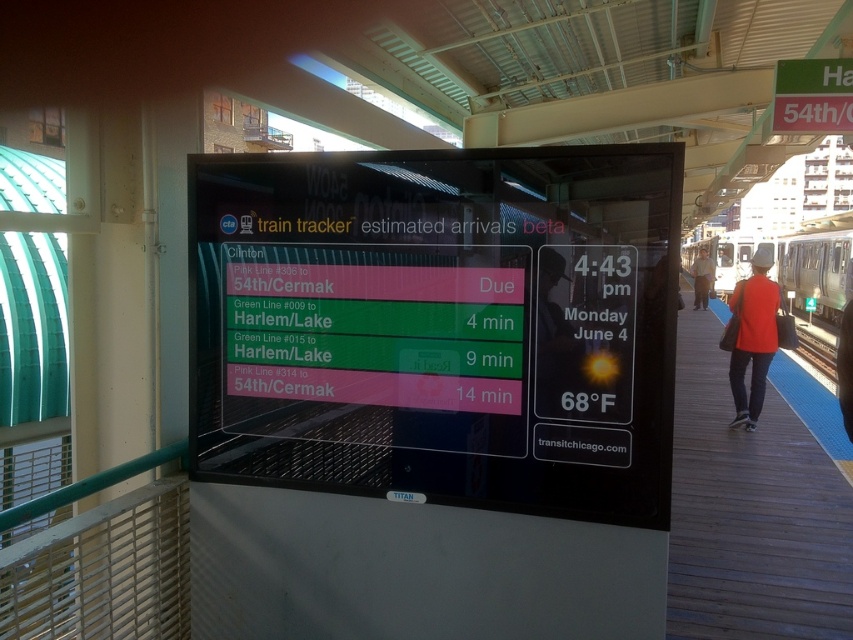
Question: Which is farther from the wooden platform at right?

Choices:
 (A) matte red shirt at center
 (B) red shirt at right
 (C) silver metallic train at right

Answer: (C)

Question: Does wooden platform at right come in front of red shirt at right?

Choices:
 (A) yes
 (B) no

Answer: (A)

Question: Which of the following is the closest to the observer?

Choices:
 (A) (740, 301)
 (B) (790, 307)
 (C) (744, 588)
 (D) (694, 305)

Answer: (C)

Question: Which point appears closest to the camera in this image?

Choices:
 (A) (683, 417)
 (B) (694, 298)
 (C) (792, 241)
 (D) (730, 368)

Answer: (D)

Question: Observing the image, what is the correct spatial positioning of matte red shirt at center in reference to red shirt at right?

Choices:
 (A) left
 (B) right

Answer: (A)

Question: Does matte red shirt at center have a lesser width compared to silver metallic train at right?

Choices:
 (A) no
 (B) yes

Answer: (B)